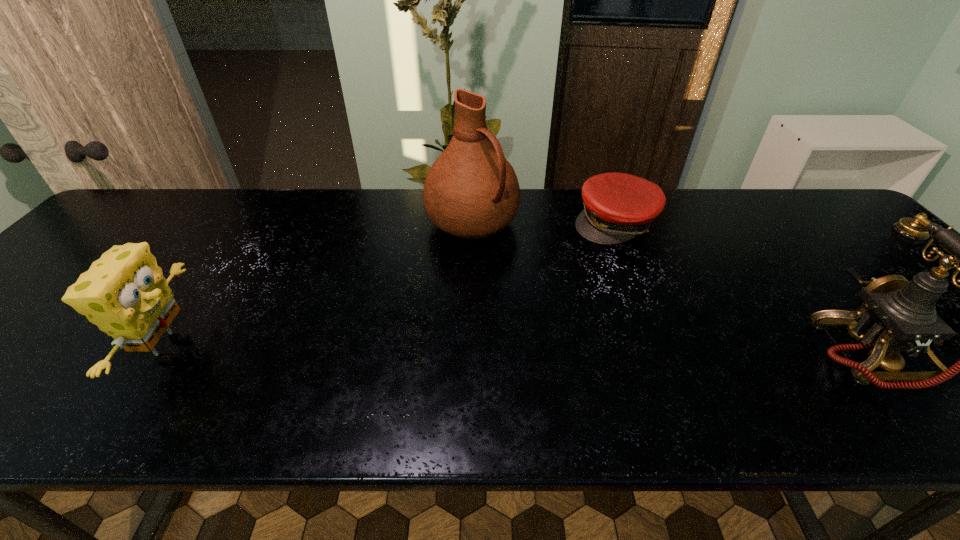
Where is `vacant space located on the front of the shortest object with an emblem`? The height and width of the screenshot is (540, 960). vacant space located on the front of the shortest object with an emblem is located at coordinates 556,289.

Image resolution: width=960 pixels, height=540 pixels. Find the location of `free region located on the front of the shortest object with an emblem`. free region located on the front of the shortest object with an emblem is located at coordinates (580, 261).

Where is `vacant region located on the front of the shortest object with an emblem`? The width and height of the screenshot is (960, 540). vacant region located on the front of the shortest object with an emblem is located at coordinates (564, 280).

This screenshot has height=540, width=960. Find the location of `pitcher that is at the far edge`. pitcher that is at the far edge is located at coordinates (471, 191).

This screenshot has width=960, height=540. I want to click on cap present at the far edge, so click(617, 207).

Image resolution: width=960 pixels, height=540 pixels. What are the coordinates of `object positioned at the near edge` in the screenshot? It's located at (124, 293).

Find the location of `vacant space at the far edge of the desktop`. vacant space at the far edge of the desktop is located at coordinates (313, 206).

Where is `vacant space at the near edge of the desktop`? vacant space at the near edge of the desktop is located at coordinates (835, 366).

Image resolution: width=960 pixels, height=540 pixels. I want to click on vacant space at the left edge, so click(x=143, y=239).

Find the location of `free space at the right edge`. free space at the right edge is located at coordinates (836, 235).